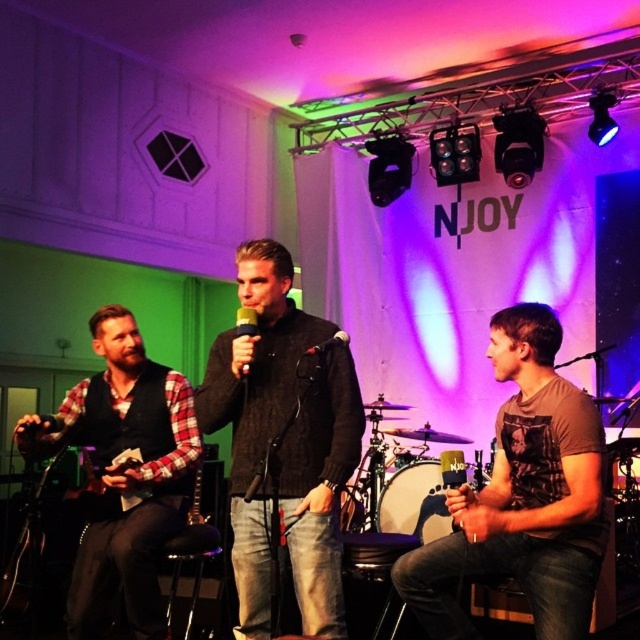
Which is behind, point (262, 483) or point (324, 346)?

The point (324, 346) is behind.

What do you see at coordinates (257, 410) in the screenshot? I see `dark gray sweater at center` at bounding box center [257, 410].

You are a GUI agent. You are given a task and a screenshot of the screen. Output one action in this format:
    pyautogui.click(x=<x>, y=<y>)
    Task: Click on the dark gray sweater at center
    Image resolution: width=640 pixels, height=640 pixels.
    Given the screenshot: What is the action you would take?
    pyautogui.click(x=257, y=410)

Looking at this image, between dark gray sweater at center and plaid fabric shirt at left, which one is positioned higher?

Positioned higher is dark gray sweater at center.

Does point (289, 298) come farther from viewer compared to point (170, 428)?

That is False.

Find the location of a particular element. Image resolution: width=640 pixels, height=640 pixels. dark gray sweater at center is located at coordinates (257, 410).

Does plaid fabric shirt at left appear on the left side of metallic silver microphone at center?

Yes, plaid fabric shirt at left is to the left of metallic silver microphone at center.

You are a GUI agent. You are given a task and a screenshot of the screen. Output one action in this format:
    pyautogui.click(x=<x>, y=<y>)
    Task: Click on the plaid fabric shirt at left
    The image size is (640, 640).
    Given the screenshot: What is the action you would take?
    pyautogui.click(x=124, y=474)

Is point (88, 412) behind point (257, 321)?

Yes, point (88, 412) is behind point (257, 321).

Identify the location of plaid fabric shirt at left. Image resolution: width=640 pixels, height=640 pixels. (124, 474).